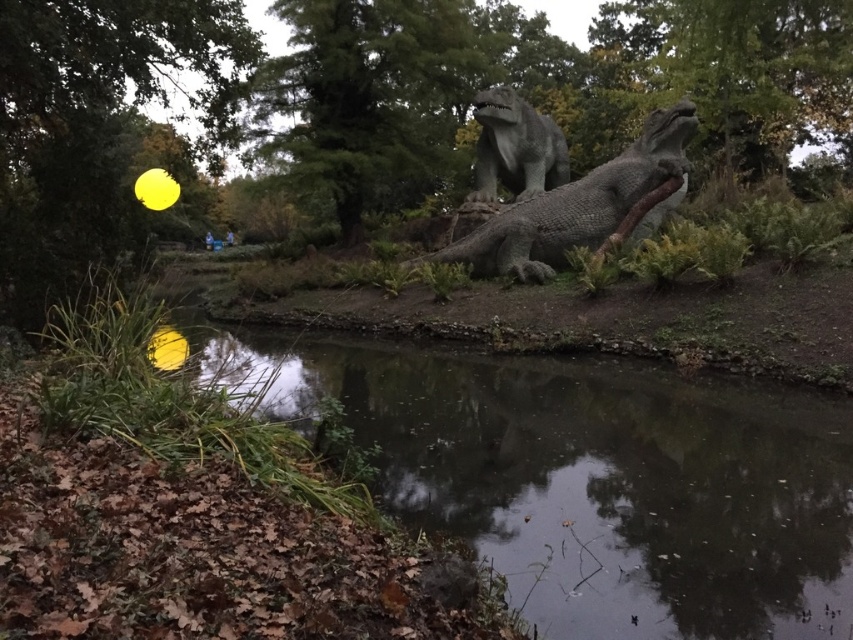
Question: Which object is positioned closest to the gray stone dinosaur at center?

Choices:
 (A) gray textured statue at center
 (B) dark reflective water at center

Answer: (A)

Question: Does dark reflective water at center appear on the left side of gray stone dinosaur at center?

Choices:
 (A) no
 (B) yes

Answer: (B)

Question: Can you confirm if dark reflective water at center is wider than gray stone dinosaur at center?

Choices:
 (A) no
 (B) yes

Answer: (B)

Question: Which point is closer to the camera?

Choices:
 (A) (500, 154)
 (B) (409, 266)
 (C) (782, 584)

Answer: (C)

Question: Where is dark reflective water at center located in relation to gray stone dinosaur at center in the image?

Choices:
 (A) above
 (B) below

Answer: (B)

Question: Which of the following is the closest to the observer?

Choices:
 (A) (523, 170)
 (B) (511, 228)
 (C) (763, 486)

Answer: (C)